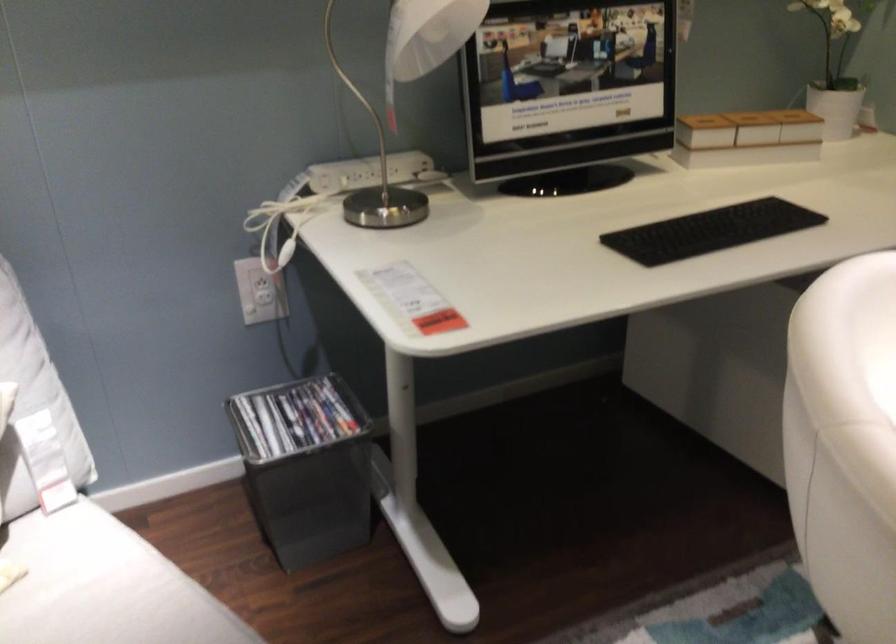
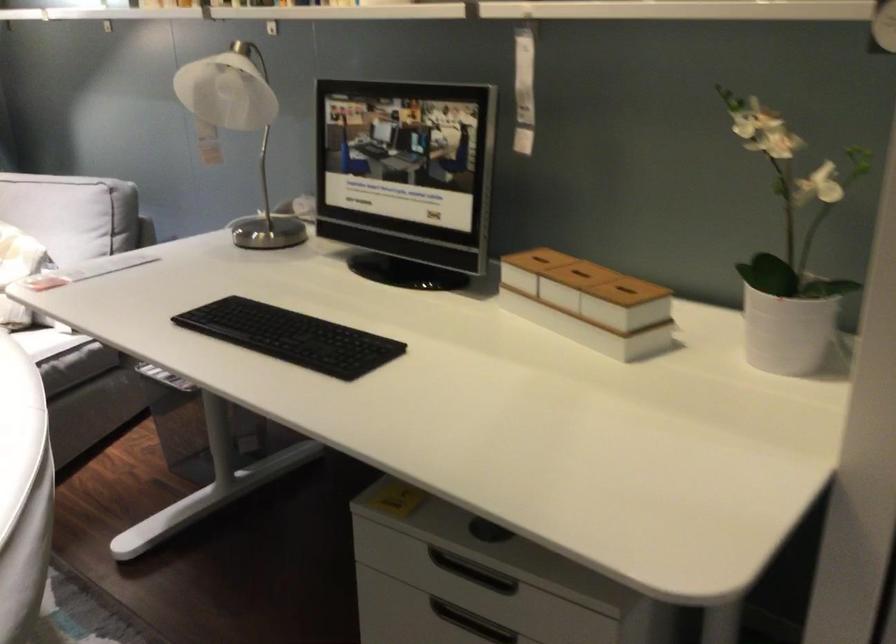
Where in the second image is the point corresponding to the point at 721,118 from the first image?

(537, 259)